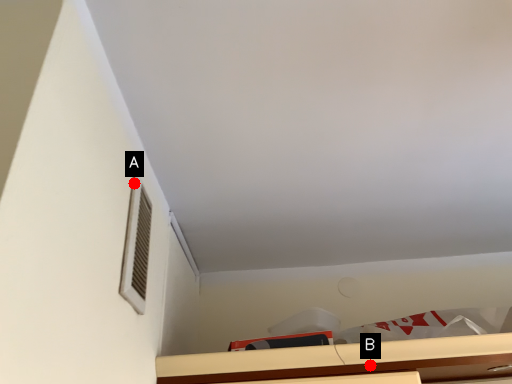
Question: Two points are circled on the image, labeled by A and B beside each circle. Which of the following is the closest to the observer?

Choices:
 (A) A is closer
 (B) B is closer

Answer: (A)